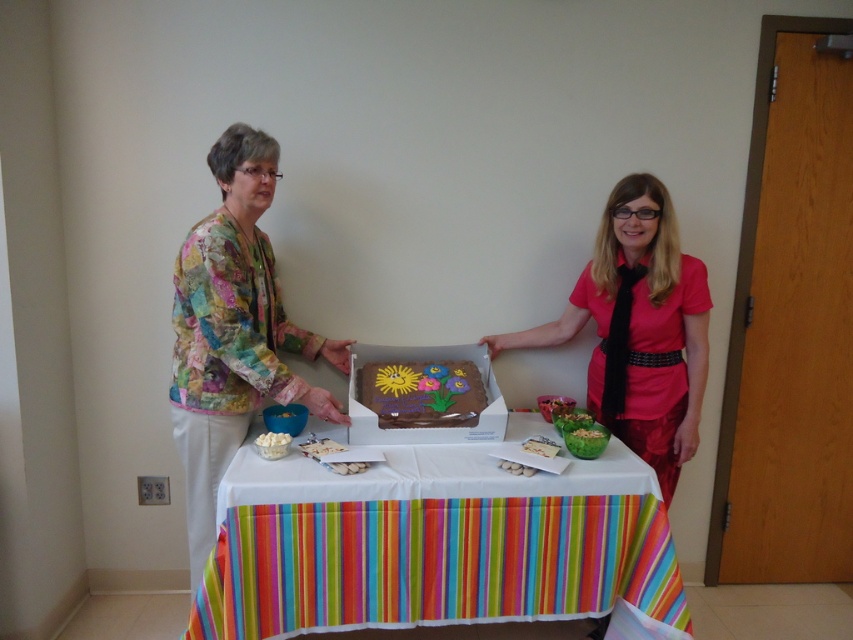
You are a guest at an event and see the matte pink shirt at center and the white creamy popcorn at lower left. Which item is closer to you?

The matte pink shirt at center is closer to you because the white creamy popcorn at lower left is behind it.

You are a photographer taking a picture of the matte pink shirt at center and the white creamy popcorn at lower left. Which object should you focus on first if you want to capture both in the same frame without moving the camera?

The matte pink shirt at center is larger in size than the white creamy popcorn at lower left, so you should focus on the matte pink shirt at center first to ensure it is in clear view before adjusting for the smaller object.